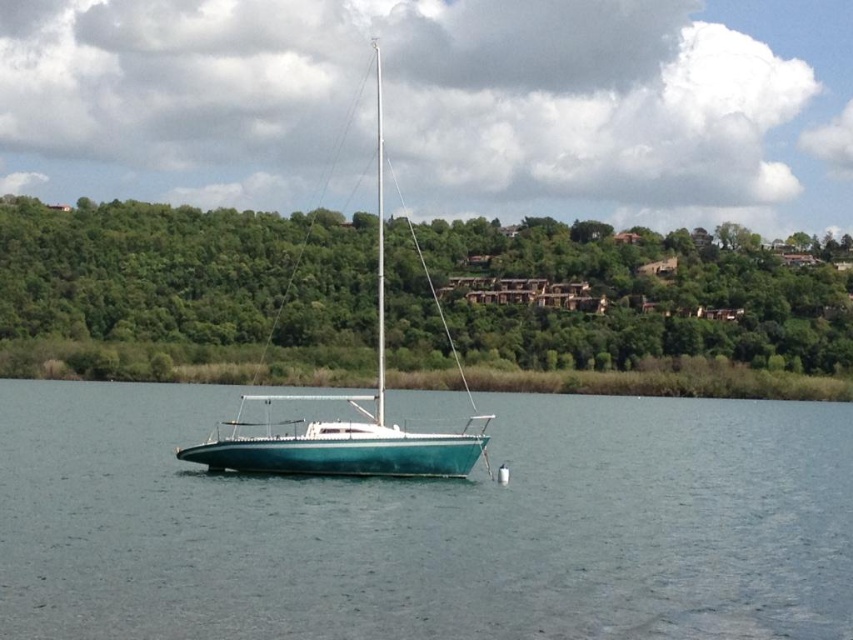
Measure the distance between teal glossy water at center and camera.

teal glossy water at center is 53.33 feet away from camera.

Is teal glossy water at center shorter than green leafy trees at upper center?

Yes, teal glossy water at center is shorter than green leafy trees at upper center.

Which is behind, point (450, 552) or point (260, 307)?

Positioned behind is point (260, 307).

Where is `teal glossy water at center`? Image resolution: width=853 pixels, height=640 pixels. teal glossy water at center is located at coordinates (428, 525).

Is teal glossy water at center to the right of teal glossy sailboat at center from the viewer's perspective?

Yes, teal glossy water at center is to the right of teal glossy sailboat at center.

Is teal glossy water at center taller than teal glossy sailboat at center?

No.

The width and height of the screenshot is (853, 640). I want to click on teal glossy water at center, so click(428, 525).

Who is higher up, green leafy trees at upper center or teal glossy sailboat at center?

teal glossy sailboat at center is higher up.

Is green leafy trees at upper center in front of teal glossy sailboat at center?

That is False.

Who is more forward, [674,298] or [399,433]?

Point [399,433] is in front.

This screenshot has width=853, height=640. Find the location of `green leafy trees at upper center`. green leafy trees at upper center is located at coordinates (640, 300).